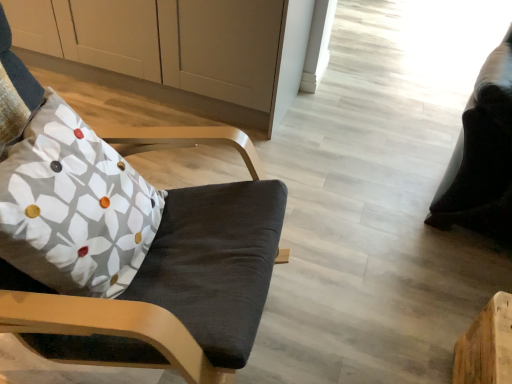
The width and height of the screenshot is (512, 384). Describe the element at coordinates (74, 207) in the screenshot. I see `floral fabric pillow at left` at that location.

The width and height of the screenshot is (512, 384). What do you see at coordinates (482, 155) in the screenshot? I see `black leather bean bag chair at right` at bounding box center [482, 155].

Locate an element on the screen. white matte cabinet at upper left is located at coordinates (183, 48).

Does floral fabric pillow at left appear on the right side of white matte cabinet at upper left?

Indeed, floral fabric pillow at left is positioned on the right side of white matte cabinet at upper left.

Between floral fabric pillow at left and white matte cabinet at upper left, which one has larger width?

white matte cabinet at upper left.

Consider the image. Is white matte cabinet at upper left at the back of floral fabric pillow at left?

No, floral fabric pillow at left's orientation is not away from white matte cabinet at upper left.

Considering the positions of objects matte black chair at left and floral fabric pillow at left in the image provided, who is behind, matte black chair at left or floral fabric pillow at left?

floral fabric pillow at left is more distant.

Does matte black chair at left have a lesser width compared to floral fabric pillow at left?

No, matte black chair at left is not thinner than floral fabric pillow at left.

Is matte black chair at left spatially inside floral fabric pillow at left, or outside of it?

matte black chair at left is not enclosed by floral fabric pillow at left.

I want to click on chair located in front of the floral fabric pillow at left, so click(x=170, y=278).

From the image's perspective, which object appears higher, white matte cabinet at upper left or matte black chair at left?

white matte cabinet at upper left appears higher in the image.

Is white matte cabinet at upper left in front of or behind matte black chair at left in the image?

Clearly, white matte cabinet at upper left is behind matte black chair at left.

Would you say matte black chair at left is part of white matte cabinet at upper left's contents?

That's incorrect, matte black chair at left is not inside white matte cabinet at upper left.

From a real-world perspective, is white matte cabinet at upper left below matte black chair at left?

Yes.

Considering the relative positions of black leather bean bag chair at right and matte black chair at left in the image provided, is black leather bean bag chair at right to the left or to the right of matte black chair at left?

Clearly, black leather bean bag chair at right is on the right of matte black chair at left in the image.

Considering the relative sizes of black leather bean bag chair at right and matte black chair at left in the image provided, is black leather bean bag chair at right thinner than matte black chair at left?

In fact, black leather bean bag chair at right might be wider than matte black chair at left.

Considering the points (474, 179) and (231, 192), which point is behind, point (474, 179) or point (231, 192)?

Point (474, 179)

How many degrees apart are the facing directions of black leather bean bag chair at right and matte black chair at left?

The facing directions of black leather bean bag chair at right and matte black chair at left are 110 degrees apart.

Which of these two, floral fabric pillow at left or matte black chair at left, is thinner?

floral fabric pillow at left is thinner.

Where is `chair beneath the floral fabric pillow at left (from a real-world perspective)`? This screenshot has height=384, width=512. chair beneath the floral fabric pillow at left (from a real-world perspective) is located at coordinates (170, 278).

What's the angular difference between floral fabric pillow at left and matte black chair at left's facing directions?

The angle between the facing direction of floral fabric pillow at left and the facing direction of matte black chair at left is 6.28 degrees.

From a real-world perspective, which is physically above, floral fabric pillow at left or matte black chair at left?

floral fabric pillow at left is physically above.

From the image's perspective, which one is positioned higher, matte black chair at left or black leather bean bag chair at right?

black leather bean bag chair at right.

Identify the location of chair that appears above the black leather bean bag chair at right (from a real-world perspective). The image size is (512, 384). (170, 278).

Is matte black chair at left wider than black leather bean bag chair at right?

In fact, matte black chair at left might be narrower than black leather bean bag chair at right.

Considering the relative sizes of matte black chair at left and black leather bean bag chair at right in the image provided, is matte black chair at left shorter than black leather bean bag chair at right?

Correct, matte black chair at left is not as tall as black leather bean bag chair at right.

In terms of size, does black leather bean bag chair at right appear bigger or smaller than floral fabric pillow at left?

Considering their sizes, black leather bean bag chair at right takes up more space than floral fabric pillow at left.

Which object is wider, black leather bean bag chair at right or floral fabric pillow at left?

Wider between the two is black leather bean bag chair at right.

From the image's perspective, is black leather bean bag chair at right located above or below floral fabric pillow at left?

black leather bean bag chair at right is situated higher than floral fabric pillow at left in the image.

The image size is (512, 384). I want to click on cabinetry that appears behind the floral fabric pillow at left, so click(x=183, y=48).

The image size is (512, 384). Find the location of `chair on the right side of floral fabric pillow at left`. chair on the right side of floral fabric pillow at left is located at coordinates (170, 278).

When comparing their distances from matte black chair at left, does white matte cabinet at upper left or black leather bean bag chair at right seem closer?

Based on the image, white matte cabinet at upper left appears to be nearer to matte black chair at left.

When comparing their distances from floral fabric pillow at left, does white matte cabinet at upper left or matte black chair at left seem further?

Based on the image, white matte cabinet at upper left appears to be further to floral fabric pillow at left.

Based on their spatial positions, is black leather bean bag chair at right or white matte cabinet at upper left closer to matte black chair at left?

The object closer to matte black chair at left is white matte cabinet at upper left.

Estimate the real-world distances between objects in this image. Which object is closer to matte black chair at left, floral fabric pillow at left or white matte cabinet at upper left?

The object closer to matte black chair at left is floral fabric pillow at left.

Which object lies nearer to the anchor point white matte cabinet at upper left, black leather bean bag chair at right or floral fabric pillow at left?

floral fabric pillow at left is closer to white matte cabinet at upper left.

Considering their positions, is black leather bean bag chair at right positioned closer to floral fabric pillow at left than white matte cabinet at upper left?

Among the two, white matte cabinet at upper left is located nearer to floral fabric pillow at left.

Considering their positions, is white matte cabinet at upper left positioned further to black leather bean bag chair at right than floral fabric pillow at left?

The object further to black leather bean bag chair at right is floral fabric pillow at left.

Considering their positions, is floral fabric pillow at left positioned further to white matte cabinet at upper left than black leather bean bag chair at right?

Based on the image, black leather bean bag chair at right appears to be further to white matte cabinet at upper left.

You are a GUI agent. You are given a task and a screenshot of the screen. Output one action in this format:
    pyautogui.click(x=<x>, y=<y>)
    Task: Click on the pillow between matte black chair at left and white matte cabinet at upper left in the front-back direction
    The image size is (512, 384).
    Given the screenshot: What is the action you would take?
    pyautogui.click(x=74, y=207)

What are the coordinates of `pillow located between white matte cabinet at upper left and black leather bean bag chair at right in the left-right direction` in the screenshot? It's located at (74, 207).

What are the coordinates of `chair between white matte cabinet at upper left and black leather bean bag chair at right from left to right` in the screenshot? It's located at (170, 278).

Locate an element on the screen. chair located between floral fabric pillow at left and black leather bean bag chair at right in the left-right direction is located at coordinates (170, 278).